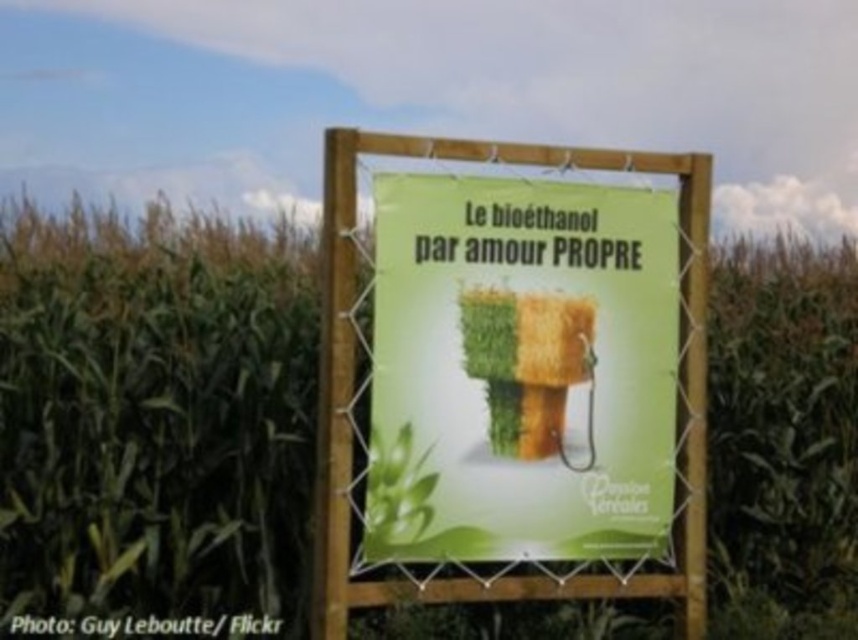
Question: Can you confirm if green leafy corn at center is positioned above green paper sign at center?

Choices:
 (A) yes
 (B) no

Answer: (B)

Question: Which object is farther from the camera taking this photo?

Choices:
 (A) green leafy corn at center
 (B) green paper sign at center

Answer: (A)

Question: Does green leafy corn at center have a smaller size compared to green paper sign at center?

Choices:
 (A) yes
 (B) no

Answer: (A)

Question: Among these points, which one is nearest to the camera?

Choices:
 (A) (110, 524)
 (B) (486, 454)

Answer: (B)

Question: Can you confirm if green leafy corn at center is positioned to the right of green paper sign at center?

Choices:
 (A) yes
 (B) no

Answer: (B)